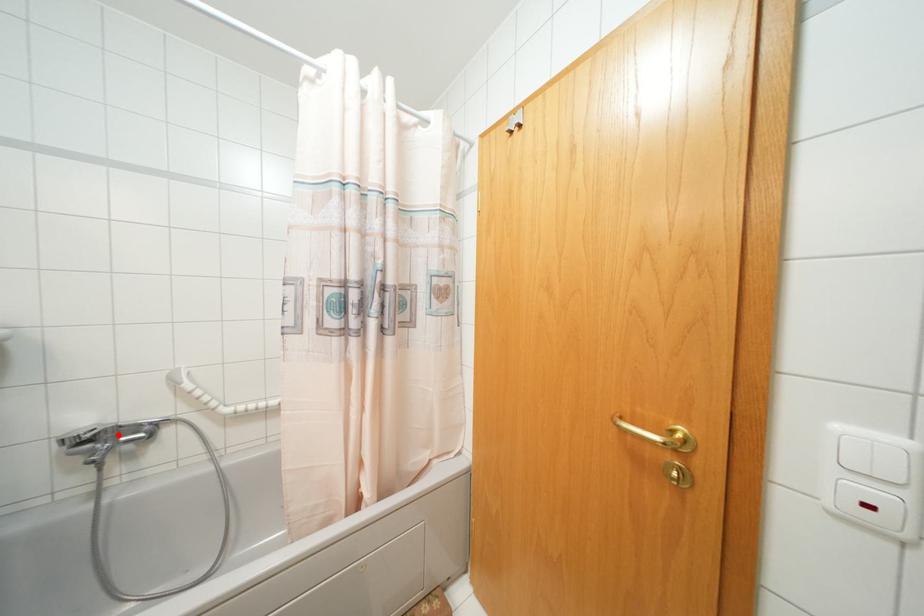
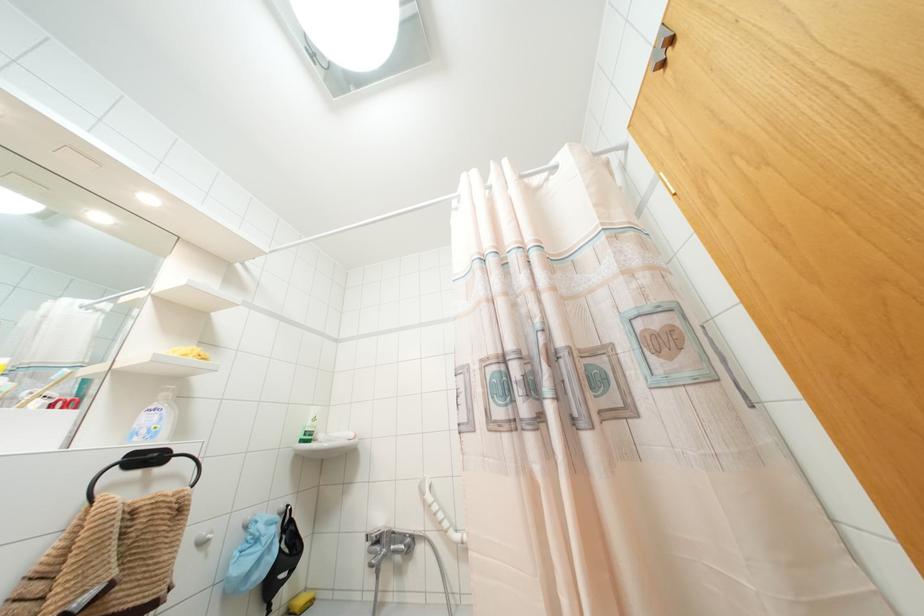
Locate, in the second image, the point that corresponds to the highlighted location in the first image.

(390, 541)